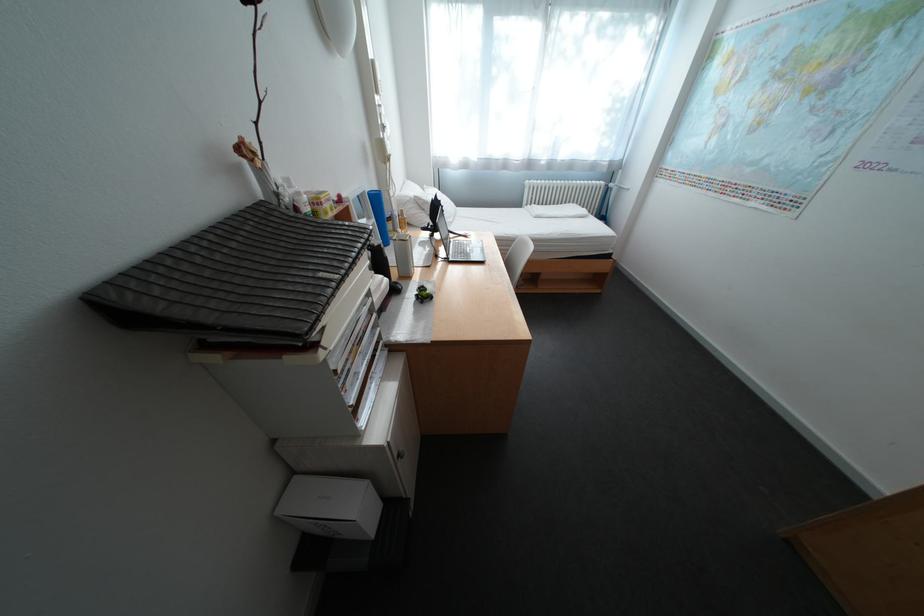
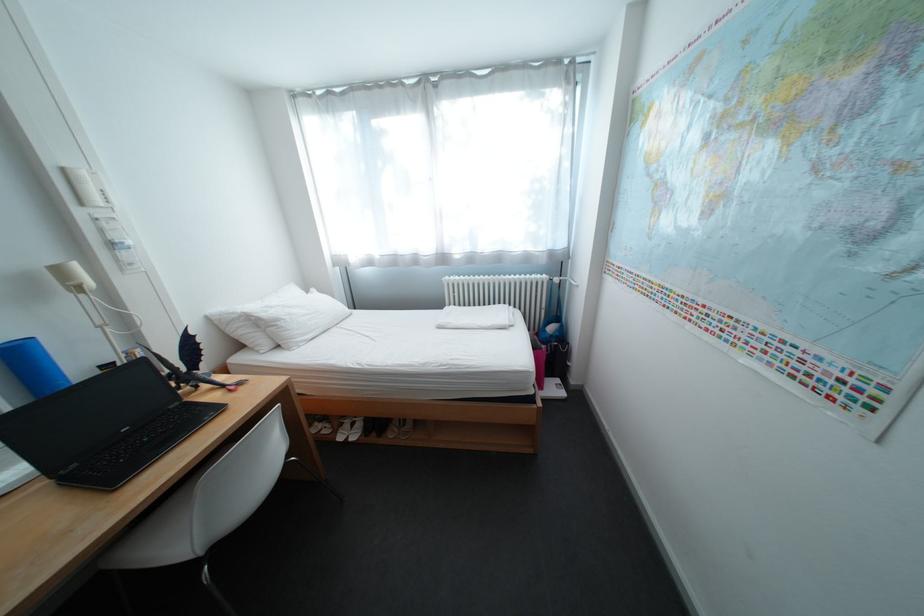
Where in the second image is the point corresponding to (385,63) from the first image?

(76, 171)